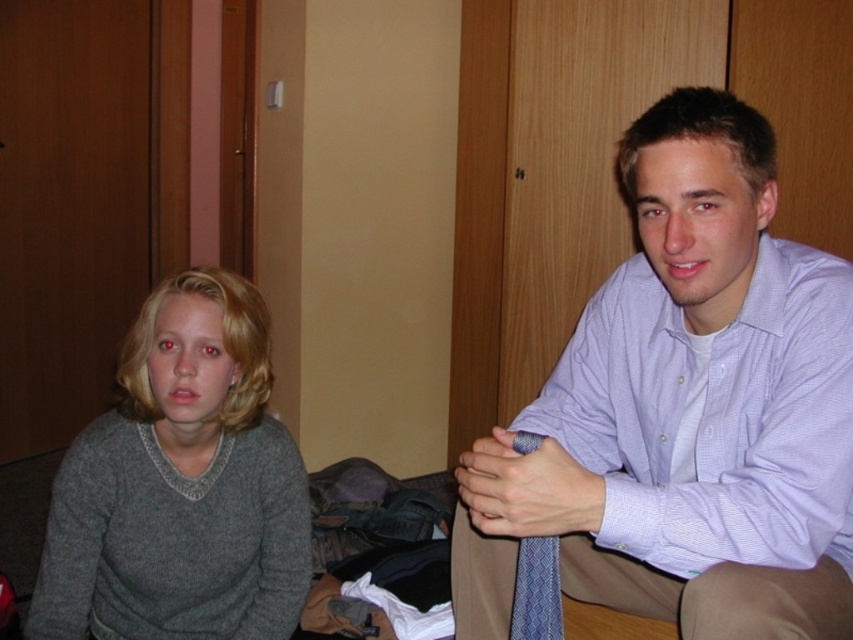
Which is behind, point (67, 522) or point (553, 564)?

Positioned behind is point (67, 522).

Find the location of a particular element. This screenshot has height=640, width=853. gray wool sweater at left is located at coordinates (180, 484).

Between light purple shirt at upper right and blue textured tie at center, which one appears on the right side from the viewer's perspective?

light purple shirt at upper right is more to the right.

Who is lower down, light purple shirt at upper right or blue textured tie at center?

blue textured tie at center

Where is `light purple shirt at upper right`? The height and width of the screenshot is (640, 853). light purple shirt at upper right is located at coordinates (685, 412).

Between light purple shirt at upper right and gray wool sweater at left, which one appears on the left side from the viewer's perspective?

From the viewer's perspective, gray wool sweater at left appears more on the left side.

Describe the element at coordinates (685, 412) in the screenshot. I see `light purple shirt at upper right` at that location.

Who is more distant from viewer, (x=554, y=385) or (x=222, y=476)?

The point (x=222, y=476) is more distant.

Find the location of a particular element. light purple shirt at upper right is located at coordinates (685, 412).